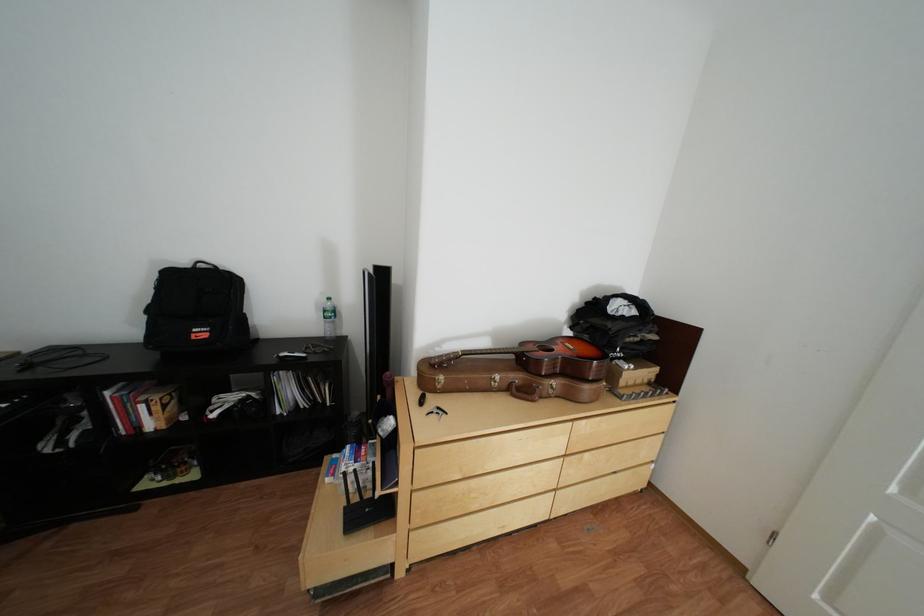
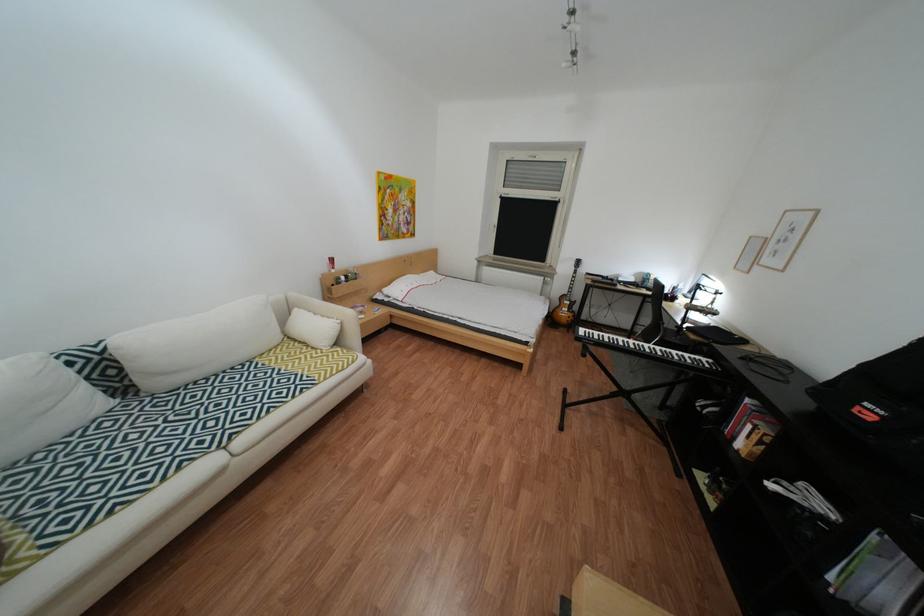
Locate, in the second image, the point that corresponds to (x=222, y=336) in the first image.

(886, 419)